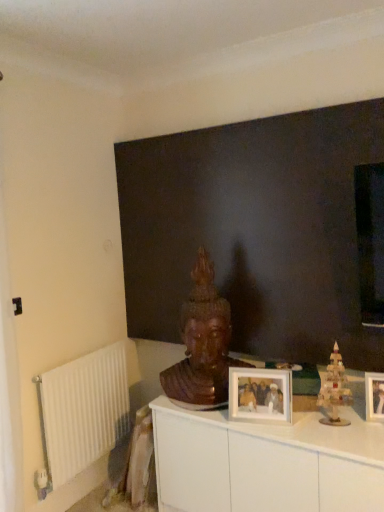
Find the location of a particular element. wooden statue at center is located at coordinates (202, 344).

Locate an element on the screen. The width and height of the screenshot is (384, 512). white glossy cabinet at center is located at coordinates (265, 463).

What do you see at coordinates (260, 394) in the screenshot? Image resolution: width=384 pixels, height=512 pixels. I see `white matte picture frame at center, arranged as the 1th picture frame when viewed from the left` at bounding box center [260, 394].

The height and width of the screenshot is (512, 384). What do you see at coordinates (259, 230) in the screenshot? I see `dark matte wall at center` at bounding box center [259, 230].

Locate an element on the screen. This screenshot has width=384, height=512. white metallic radiator at left is located at coordinates (83, 411).

This screenshot has width=384, height=512. I want to click on wooden statue at center, so [x=202, y=344].

From the image's perspective, between white matte picture frame at center, arranged as the 1th picture frame when viewed from the left, and dark matte wall at center, which one is located above?

dark matte wall at center is shown above in the image.

From the picture: From a real-world perspective, which object rests below the other?

white matte picture frame at center, placed as the 2th picture frame when sorted from right to left, is physically lower.

Between white matte picture frame at center, placed as the 2th picture frame when sorted from right to left, and dark matte wall at center, which one has larger width?

With larger width is dark matte wall at center.

Which object is positioned more to the right, white matte picture frame at center, placed as the 2th picture frame when sorted from right to left, or dark matte wall at center?

white matte picture frame at center, placed as the 2th picture frame when sorted from right to left.

Is wooden statue at center to the left or to the right of white glossy cabinet at center in the image?

From the image, it's evident that wooden statue at center is to the left of white glossy cabinet at center.

Is wooden statue at center closer to the viewer compared to white glossy cabinet at center?

No, it is behind white glossy cabinet at center.

Choose the correct answer: Is wooden statue at center inside white glossy cabinet at center or outside it?

wooden statue at center is spatially situated outside white glossy cabinet at center.

From their relative heights in the image, would you say dark matte wall at center is taller or shorter than white metallic radiator at left?

Considering their sizes, dark matte wall at center has more height than white metallic radiator at left.

Is dark matte wall at center thinner than white metallic radiator at left?

No, dark matte wall at center is not thinner than white metallic radiator at left.

Relative to white metallic radiator at left, is dark matte wall at center in front or behind?

Clearly, dark matte wall at center is in front of white metallic radiator at left.

From the image's perspective, who appears lower, dark matte wall at center or white metallic radiator at left?

From the image's view, white metallic radiator at left is below.

Is dark matte wall at center aimed at white matte picture frame at center, arranged as the 1th picture frame when viewed from the left?

Yes, dark matte wall at center is aimed at white matte picture frame at center, arranged as the 1th picture frame when viewed from the left.

Which picture frame is the 1st one when counting from the right side of the dark matte wall at center? Please provide its 2D coordinates.

[(260, 394)]

Does dark matte wall at center have a larger size compared to white matte picture frame at center, arranged as the 1th picture frame when viewed from the left?

Yes, dark matte wall at center is bigger than white matte picture frame at center, arranged as the 1th picture frame when viewed from the left.

Is point (120, 383) behind point (379, 410)?

Yes, it is behind point (379, 410).

Could you measure the distance between white metallic radiator at left and wooden picture frame at center, the 1th picture frame viewed from the right?

They are 4.64 feet apart.

Is the depth of white metallic radiator at left less than that of wooden picture frame at center, the 1th picture frame viewed from the right?

No, it is not.

Who is shorter, white metallic radiator at left or wooden picture frame at center, acting as the second picture frame starting from the left?

Standing shorter between the two is wooden picture frame at center, acting as the second picture frame starting from the left.

Which of these two, wooden statue at center or white matte picture frame at center, placed as the 2th picture frame when sorted from right to left, is wider?

wooden statue at center is wider.

Relative to white matte picture frame at center, placed as the 2th picture frame when sorted from right to left, is wooden statue at center in front or behind?

Clearly, wooden statue at center is behind white matte picture frame at center, placed as the 2th picture frame when sorted from right to left.

Which is closer to the camera, (198, 332) or (279, 375)?

The point (279, 375) is more forward.

At what (x,y) coordinates should I click in order to perform the action: click on person lying on the right of white metallic radiator at left. Please return your answer as a coordinate pair (x, y). The width and height of the screenshot is (384, 512). Looking at the image, I should click on (202, 344).

Can you confirm if white metallic radiator at left is shorter than wooden statue at center?

Correct, white metallic radiator at left is not as tall as wooden statue at center.

From the image's perspective, is white metallic radiator at left beneath wooden statue at center?

Yes.

Which object is further away from the camera, white metallic radiator at left or wooden statue at center?

white metallic radiator at left is further from the camera.

There is a white matte picture frame at center, arranged as the 1th picture frame when viewed from the left. At what (x,y) coordinates should I click in order to perform the action: click on backdrop above it (from a real-world perspective). Please return your answer as a coordinate pair (x, y). Looking at the image, I should click on (259, 230).

This screenshot has width=384, height=512. Find the location of `cabinetry beneath the wooden statue at center (from a real-world perspective)`. cabinetry beneath the wooden statue at center (from a real-world perspective) is located at coordinates (265, 463).

Estimate the real-world distances between objects in this image. Which object is closer to wooden christmas tree at right, white glossy cabinet at center or white metallic radiator at left?

white glossy cabinet at center.

Considering their positions, is dark matte wall at center positioned closer to wooden statue at center than white metallic radiator at left?

Among the two, dark matte wall at center is located nearer to wooden statue at center.

Considering their positions, is white glossy cabinet at center positioned further to wooden statue at center than white metallic radiator at left?

Based on the image, white metallic radiator at left appears to be further to wooden statue at center.

Which object lies nearer to the anchor point wooden christmas tree at right, wooden picture frame at center, acting as the second picture frame starting from the left, or white glossy cabinet at center?

Based on the image, wooden picture frame at center, acting as the second picture frame starting from the left, appears to be nearer to wooden christmas tree at right.

Based on their spatial positions, is wooden picture frame at center, the 1th picture frame viewed from the right, or wooden christmas tree at right closer to white matte picture frame at center, placed as the 2th picture frame when sorted from right to left?

Among the two, wooden christmas tree at right is located nearer to white matte picture frame at center, placed as the 2th picture frame when sorted from right to left.

Looking at the image, which one is located further to white matte picture frame at center, placed as the 2th picture frame when sorted from right to left, wooden statue at center or wooden picture frame at center, acting as the second picture frame starting from the left?

wooden picture frame at center, acting as the second picture frame starting from the left, is positioned further to the anchor white matte picture frame at center, placed as the 2th picture frame when sorted from right to left.

Considering their positions, is wooden statue at center positioned further to wooden picture frame at center, the 1th picture frame viewed from the right, than dark matte wall at center?

The object further to wooden picture frame at center, the 1th picture frame viewed from the right, is dark matte wall at center.

Based on their spatial positions, is dark matte wall at center or white glossy cabinet at center further from white matte picture frame at center, placed as the 2th picture frame when sorted from right to left?

Based on the image, dark matte wall at center appears to be further to white matte picture frame at center, placed as the 2th picture frame when sorted from right to left.

Identify the location of picture frame between wooden statue at center and wooden picture frame at center, the 1th picture frame viewed from the right, from left to right. This screenshot has width=384, height=512. (260, 394).

Identify the location of cabinetry located between wooden statue at center and wooden picture frame at center, acting as the second picture frame starting from the left, in the left-right direction. (265, 463).

At what (x,y) coordinates should I click in order to perform the action: click on person between dark matte wall at center and wooden christmas tree at right in the vertical direction. Please return your answer as a coordinate pair (x, y). The height and width of the screenshot is (512, 384). Looking at the image, I should click on (202, 344).

Locate an element on the screen. cabinetry between white metallic radiator at left and wooden christmas tree at right in the horizontal direction is located at coordinates (265, 463).